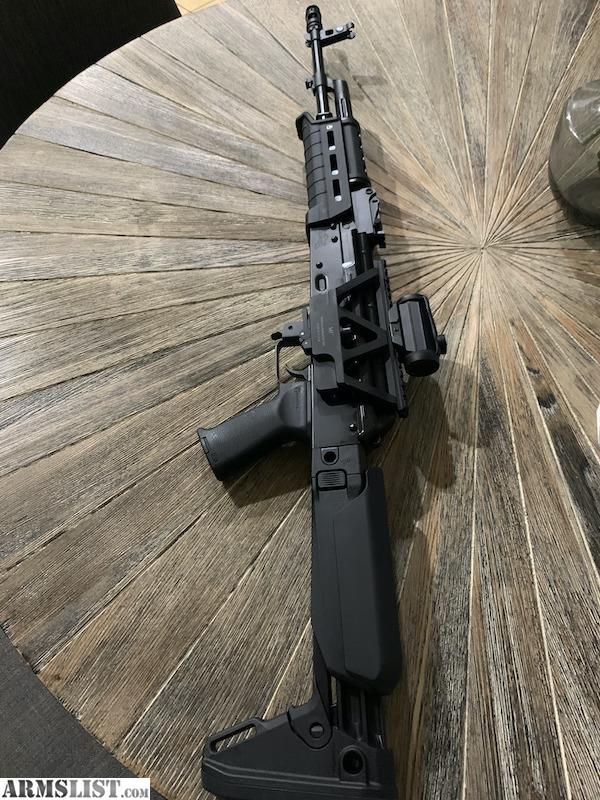
Find the location of a particular element. hook is located at coordinates (237, 730).